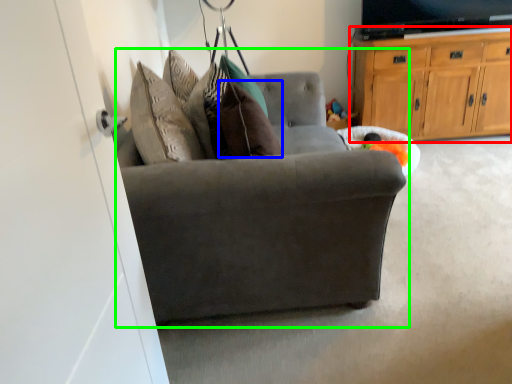
Question: Estimate the real-world distances between objects in this image. Which object is closer to cabinetry (highlighted by a red box), pillow (highlighted by a blue box) or chair (highlighted by a green box)?

Choices:
 (A) pillow
 (B) chair

Answer: (B)